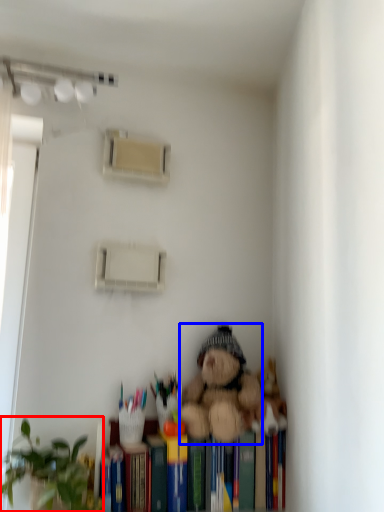
Question: Which point is further to the camera, houseplant (highlighted by a red box) or teddy bear (highlighted by a blue box)?

Choices:
 (A) houseplant
 (B) teddy bear

Answer: (B)